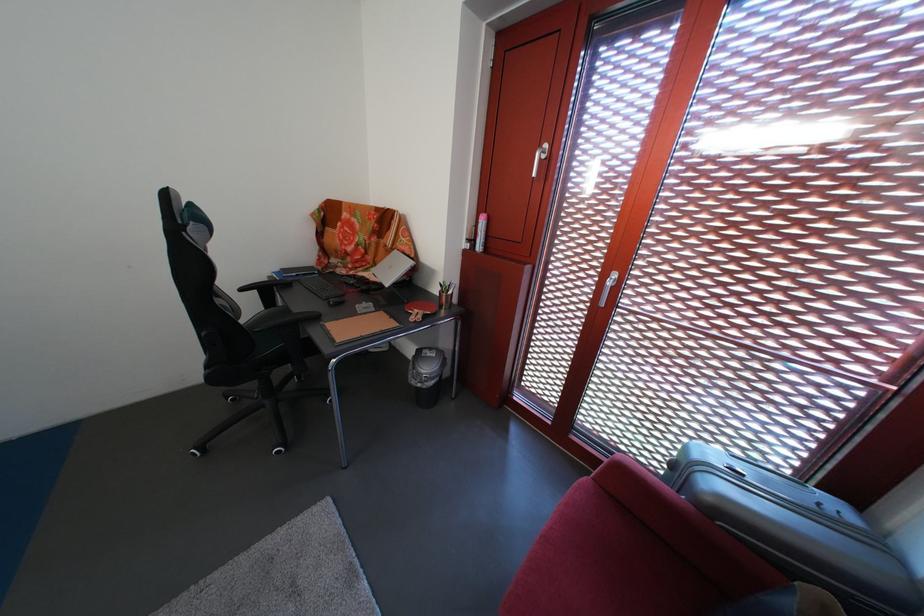
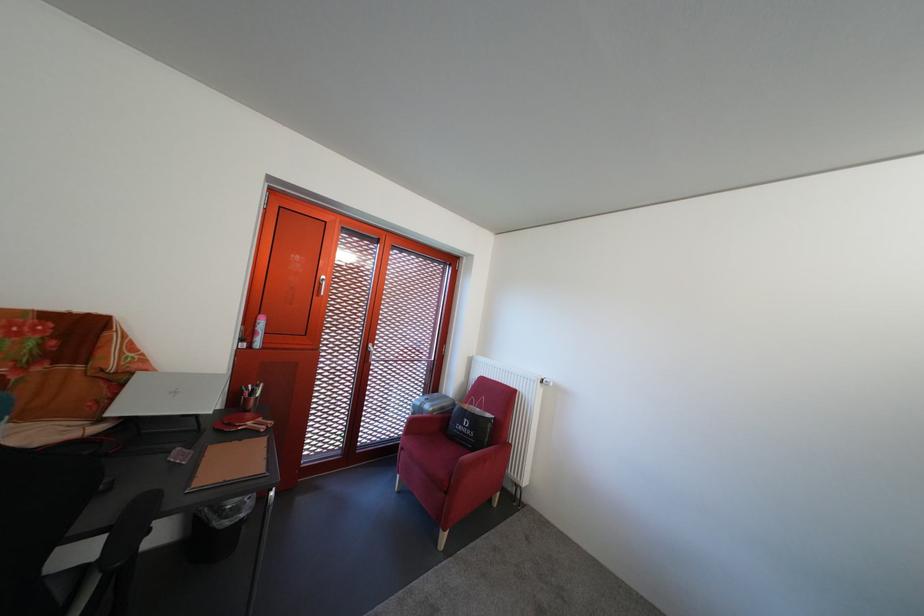
Where in the second image is the point corresponding to [479,246] from the first image?

(252, 346)